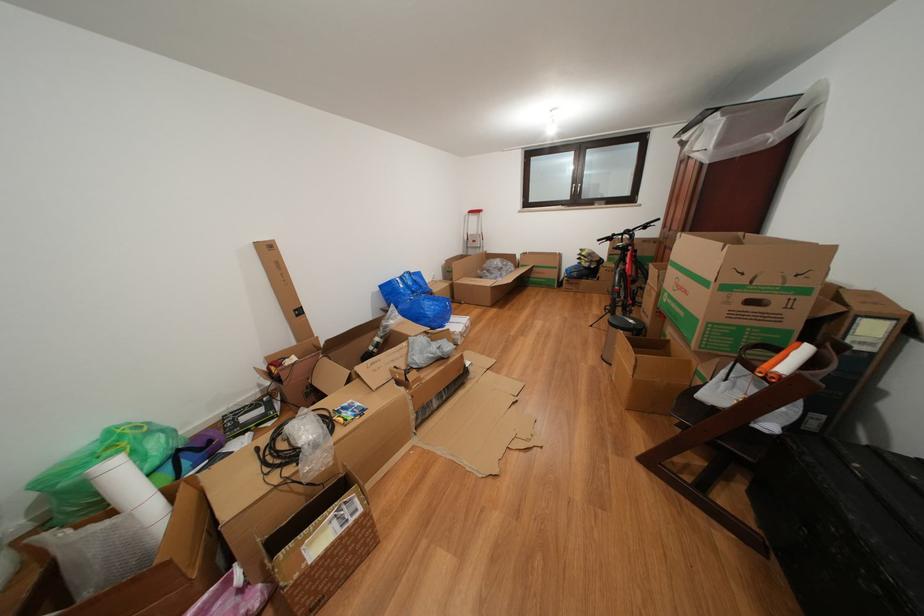
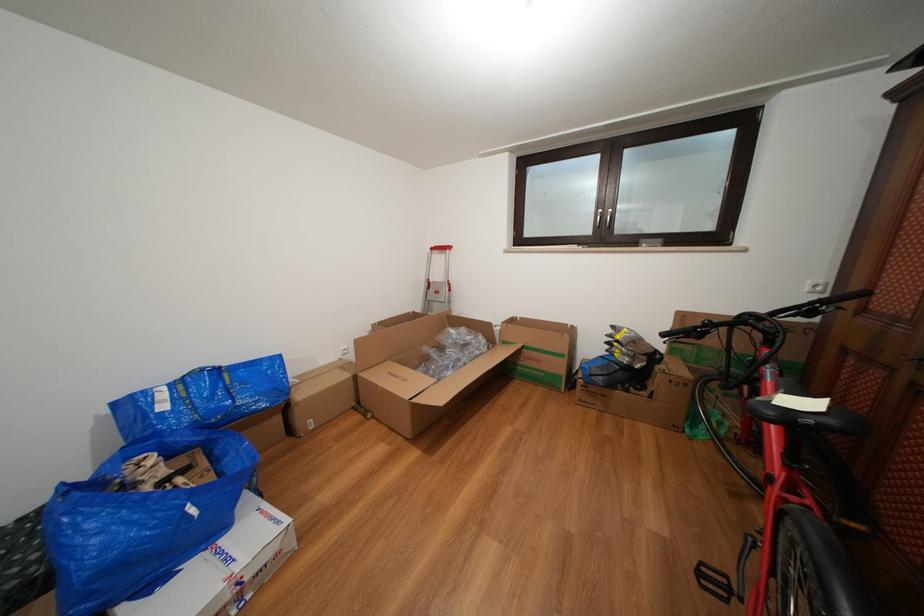
Find the pixel in the second image that matches (x=444, y=294) in the first image.

(309, 400)